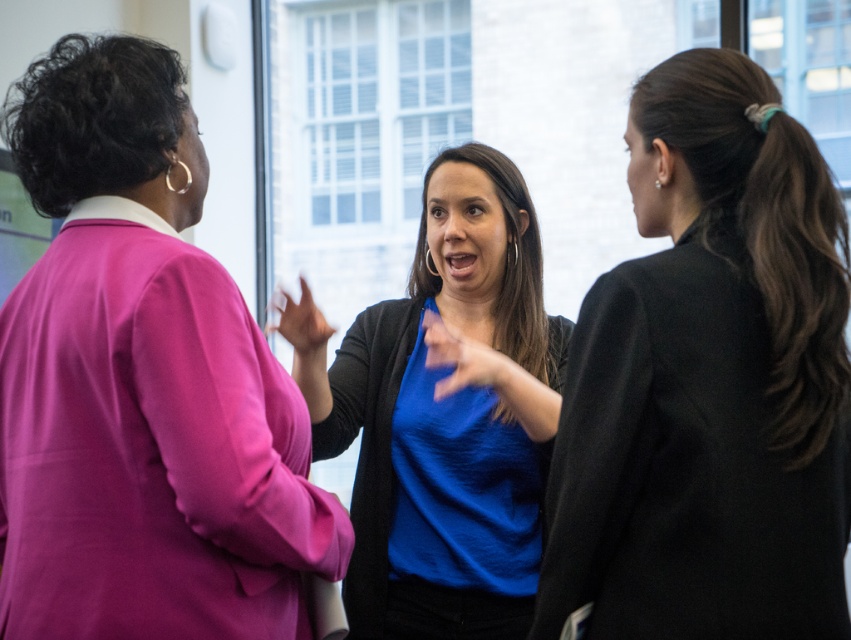
Question: Does matte pink blazer at left have a greater width compared to blue matte shirt at center?

Choices:
 (A) no
 (B) yes

Answer: (B)

Question: Can you confirm if black matte blazer at right is positioned to the right of blue matte shirt at center?

Choices:
 (A) yes
 (B) no

Answer: (A)

Question: Which object appears closest to the camera in this image?

Choices:
 (A) black matte blazer at right
 (B) matte pink blazer at left

Answer: (A)

Question: Which object is the farthest from the blue matte shirt at center?

Choices:
 (A) matte pink blazer at left
 (B) black matte blazer at right

Answer: (B)

Question: Does black matte blazer at right appear over blue matte shirt at center?

Choices:
 (A) yes
 (B) no

Answer: (A)

Question: Among these points, which one is farthest from the camera?

Choices:
 (A) (347, 364)
 (B) (157, 355)

Answer: (A)